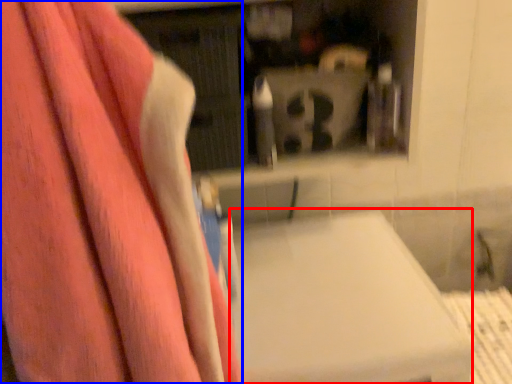
Question: Among these objects, which one is farthest to the camera, lift (highlighted by a red box) or towel (highlighted by a blue box)?

Choices:
 (A) lift
 (B) towel

Answer: (A)